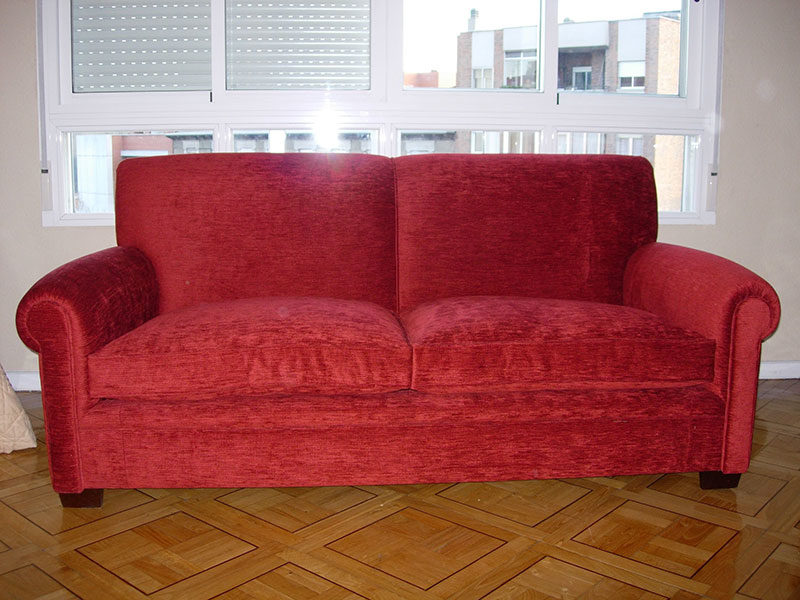
At what (x,y) coordinates should I click in order to perform the action: click on cushions. Please return your answer as a coordinate pair (x, y). The height and width of the screenshot is (600, 800). Looking at the image, I should click on coord(248,363), coord(514,363).